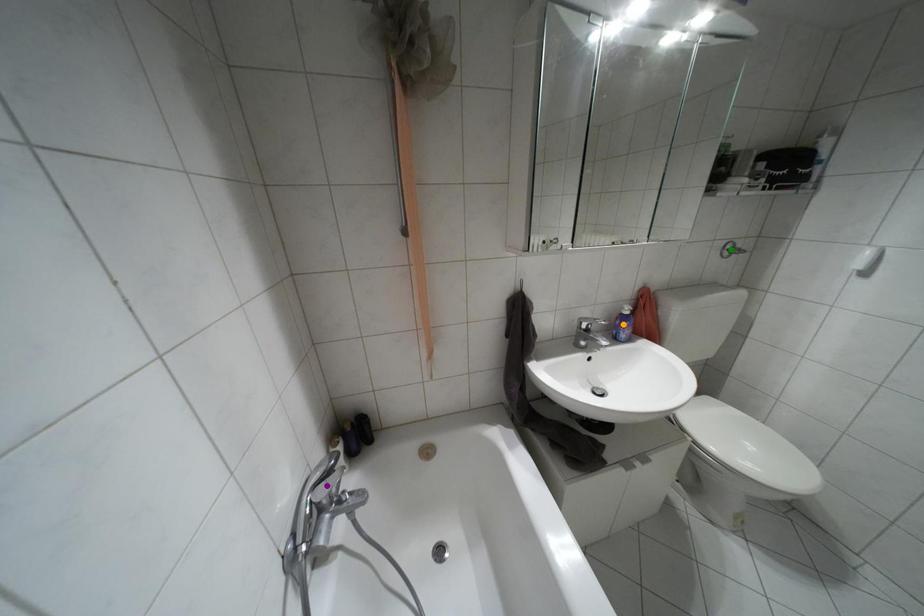
Order these from nearest to farthest:
1. green point
2. orange point
3. purple point

purple point
orange point
green point